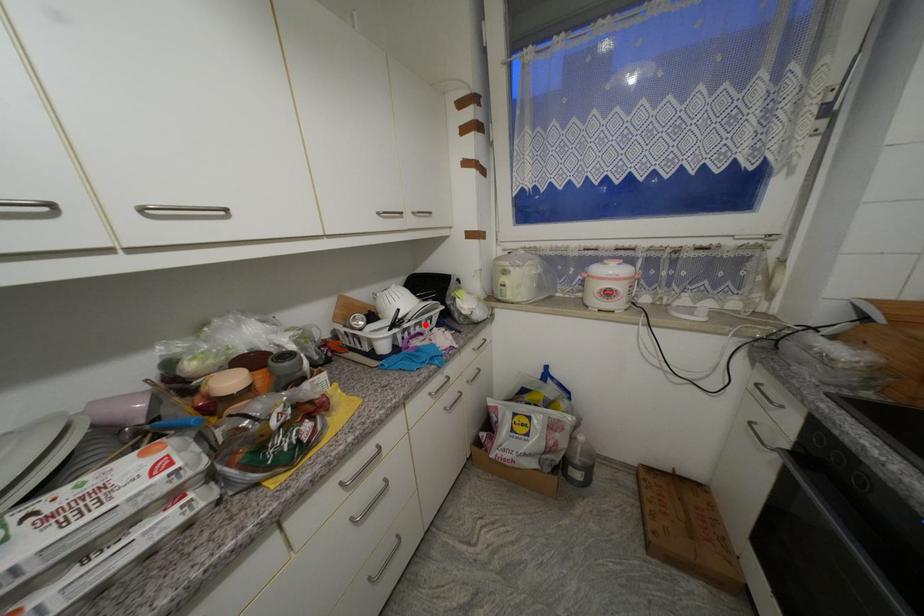
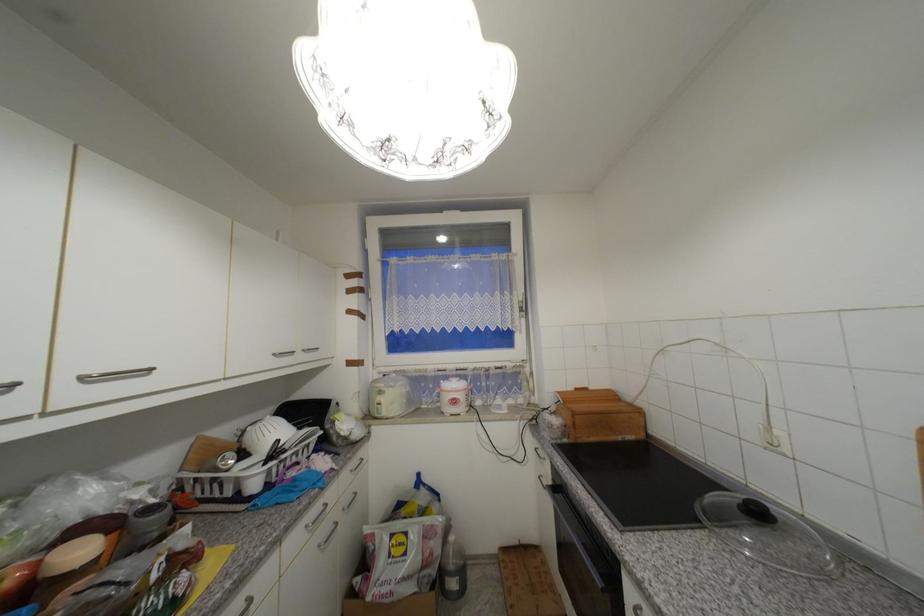
In the second image, find the point that corresponds to the highlighted location in the first image.

(301, 454)